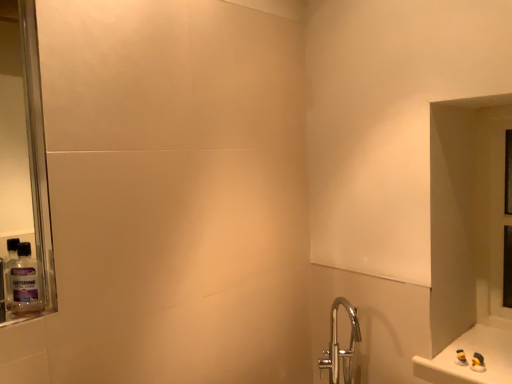
Question: Can you confirm if clear plastic mouthwash at left is wider than transparent glass door at right?

Choices:
 (A) no
 (B) yes

Answer: (A)

Question: From a real-world perspective, is clear plastic mouthwash at left beneath transparent glass door at right?

Choices:
 (A) no
 (B) yes

Answer: (A)

Question: Is clear plastic mouthwash at left turned away from transparent glass door at right?

Choices:
 (A) yes
 (B) no

Answer: (B)

Question: Does clear plastic mouthwash at left appear on the right side of transparent glass door at right?

Choices:
 (A) yes
 (B) no

Answer: (B)

Question: Does clear plastic mouthwash at left touch transparent glass door at right?

Choices:
 (A) yes
 (B) no

Answer: (B)

Question: From a real-world perspective, is white glossy counter at lower right above or below transparent glass door at right?

Choices:
 (A) below
 (B) above

Answer: (A)

Question: In terms of height, does white glossy counter at lower right look taller or shorter compared to transparent glass door at right?

Choices:
 (A) short
 (B) tall

Answer: (A)

Question: Considering their positions, is white glossy counter at lower right located in front of or behind transparent glass door at right?

Choices:
 (A) front
 (B) behind

Answer: (A)

Question: Is point (489, 357) positioned closer to the camera than point (500, 306)?

Choices:
 (A) closer
 (B) farther

Answer: (A)

Question: From the image's perspective, is clear plastic mouthwash at left above or below white glossy counter at lower right?

Choices:
 (A) above
 (B) below

Answer: (A)

Question: Is clear plastic mouthwash at left situated inside white glossy counter at lower right or outside?

Choices:
 (A) outside
 (B) inside

Answer: (A)

Question: Based on their positions, is clear plastic mouthwash at left located to the left or right of white glossy counter at lower right?

Choices:
 (A) right
 (B) left

Answer: (B)

Question: In the image, is clear plastic mouthwash at left positioned in front of or behind white glossy counter at lower right?

Choices:
 (A) front
 (B) behind

Answer: (A)

Question: Looking at the image, does transparent glass door at right seem bigger or smaller compared to clear plastic mouthwash at left?

Choices:
 (A) small
 (B) big

Answer: (B)

Question: Relative to clear plastic mouthwash at left, is transparent glass door at right in front or behind?

Choices:
 (A) behind
 (B) front

Answer: (A)